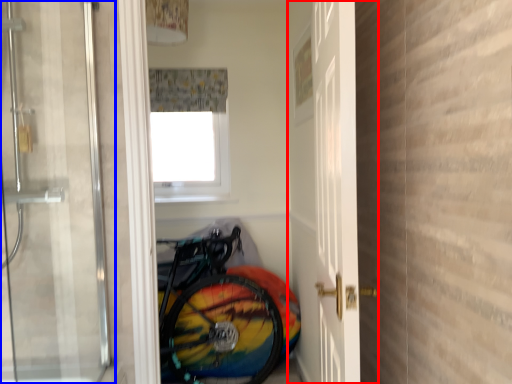
Question: Which of the following is the closest to the observer, door (highlighted by a red box) or door (highlighted by a blue box)?

Choices:
 (A) door
 (B) door

Answer: (B)